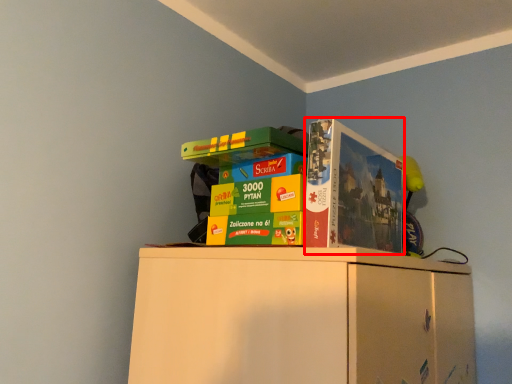
Question: From the image, what is the correct spatial relationship of paperback book (annotated by the red box) in relation to collection?

Choices:
 (A) left
 (B) right

Answer: (B)